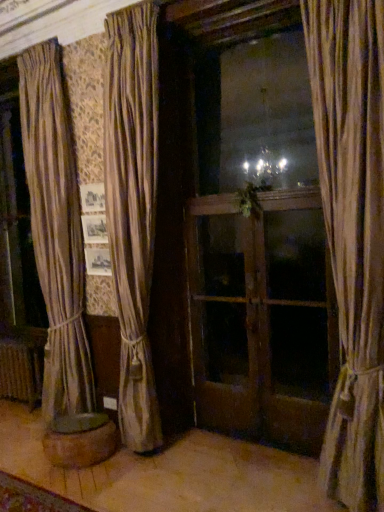
Identify the location of free spot in front of rustic metal radiator at lower left. (19, 418).